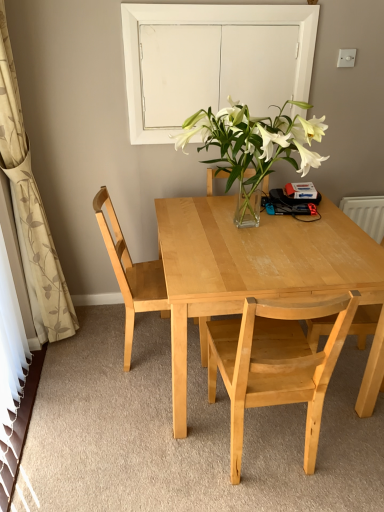
Question: From a real-world perspective, is light wood chair at left, which ranks as the 1th chair in left-to-right order, over white glass door at upper center?

Choices:
 (A) yes
 (B) no

Answer: (B)

Question: Is light wood chair at left, which ranks as the 1th chair in left-to-right order, to the right of white glass door at upper center from the viewer's perspective?

Choices:
 (A) yes
 (B) no

Answer: (B)

Question: From the image's perspective, is light wood chair at left, which ranks as the 1th chair in left-to-right order, beneath white glass door at upper center?

Choices:
 (A) no
 (B) yes

Answer: (B)

Question: Does light wood chair at left, the third chair from the right, lie in front of white glass door at upper center?

Choices:
 (A) yes
 (B) no

Answer: (A)

Question: Is light wood chair at left, which ranks as the 1th chair in left-to-right order, oriented away from white glass door at upper center?

Choices:
 (A) yes
 (B) no

Answer: (B)

Question: Is white glass door at upper center wider or thinner than light wood table at center?

Choices:
 (A) thin
 (B) wide

Answer: (A)

Question: In the image, is white glass door at upper center positioned in front of or behind light wood table at center?

Choices:
 (A) front
 (B) behind

Answer: (B)

Question: From a real-world perspective, is white glass door at upper center physically located above or below light wood table at center?

Choices:
 (A) below
 (B) above

Answer: (B)

Question: Choose the correct answer: Is white glass door at upper center inside light wood table at center or outside it?

Choices:
 (A) outside
 (B) inside

Answer: (A)

Question: Based on their positions, is white glass door at upper center located to the left or right of light wood chair at left, which ranks as the 1th chair in left-to-right order?

Choices:
 (A) left
 (B) right

Answer: (B)

Question: In terms of width, does white glass door at upper center look wider or thinner when compared to light wood chair at left, which ranks as the 1th chair in left-to-right order?

Choices:
 (A) wide
 (B) thin

Answer: (B)

Question: From a real-world perspective, relative to light wood chair at left, the third chair from the right, is white glass door at upper center vertically above or below?

Choices:
 (A) above
 (B) below

Answer: (A)

Question: Considering the positions of point (230, 20) and point (124, 252), is point (230, 20) closer or farther from the camera than point (124, 252)?

Choices:
 (A) farther
 (B) closer

Answer: (B)

Question: Looking at their shapes, would you say beige floral fabric curtain at left is wider or thinner than light wood chair at left, which ranks as the 1th chair in left-to-right order?

Choices:
 (A) thin
 (B) wide

Answer: (A)

Question: Relative to light wood chair at left, which ranks as the 1th chair in left-to-right order, is beige floral fabric curtain at left in front or behind?

Choices:
 (A) front
 (B) behind

Answer: (A)